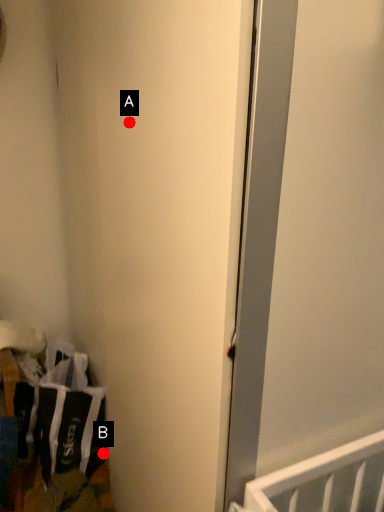
Question: Two points are circled on the image, labeled by A and B beside each circle. Which point is further to the camera?

Choices:
 (A) A is further
 (B) B is further

Answer: (B)